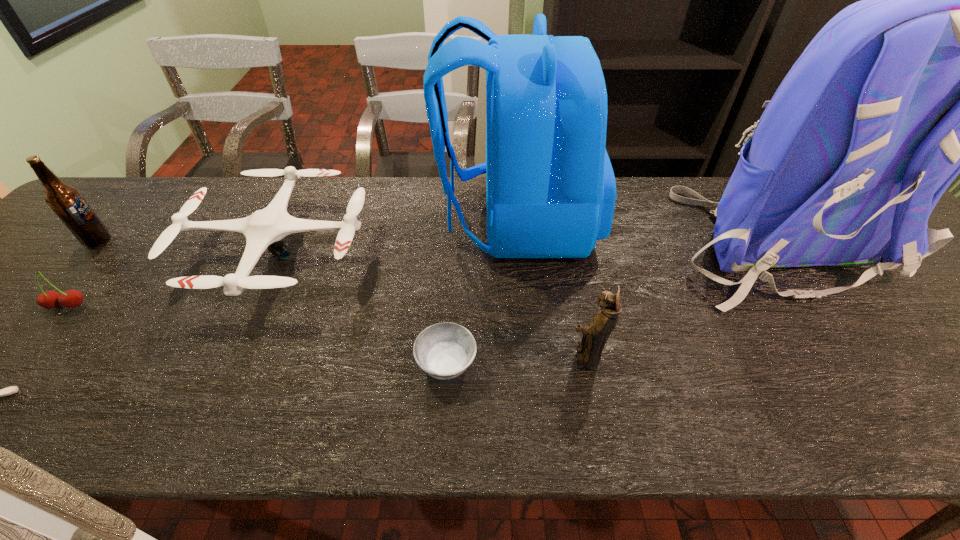
This screenshot has height=540, width=960. I want to click on the rightmost object, so click(x=959, y=58).

What are the coordinates of `the tallest object` in the screenshot? It's located at (959, 58).

Locate an element on the screen. the shorter backpack is located at coordinates (550, 187).

This screenshot has width=960, height=540. What are the coordinates of `the second tallest object` in the screenshot? It's located at (550, 187).

Locate an element on the screen. the sixth shortest object is located at coordinates (66, 201).

At what (x,y) coordinates should I click in order to perform the action: click on the fourth tallest object. Please return your answer as a coordinate pair (x, y). Image resolution: width=960 pixels, height=540 pixels. Looking at the image, I should click on (595, 335).

This screenshot has height=540, width=960. Find the location of `drone`. drone is located at coordinates (265, 228).

This screenshot has height=540, width=960. Find the location of `cherry`. cherry is located at coordinates (72, 298).

Find the location of a particular element. ashtray is located at coordinates (445, 350).

I want to click on vacant position located 0.280m on the back of the tallest object, so click(x=913, y=437).